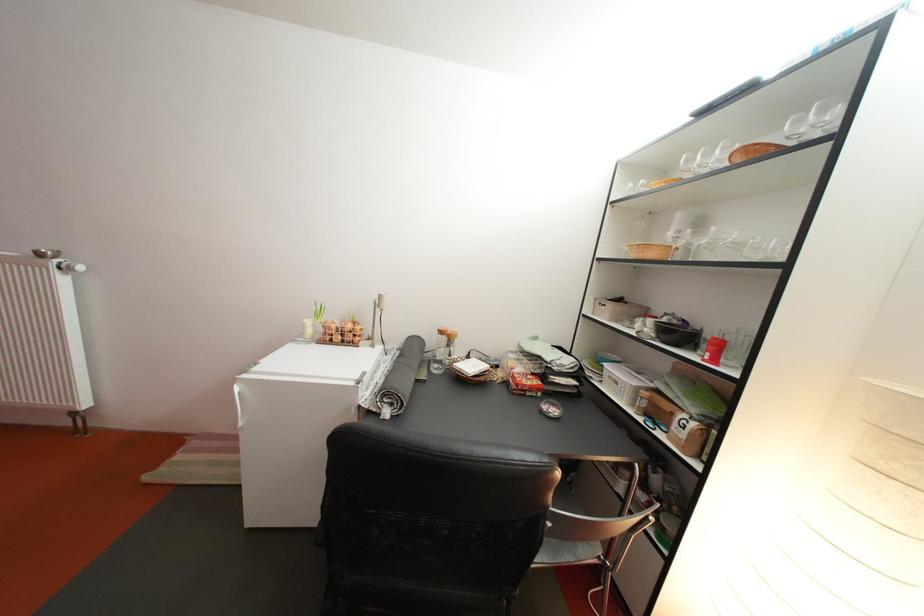
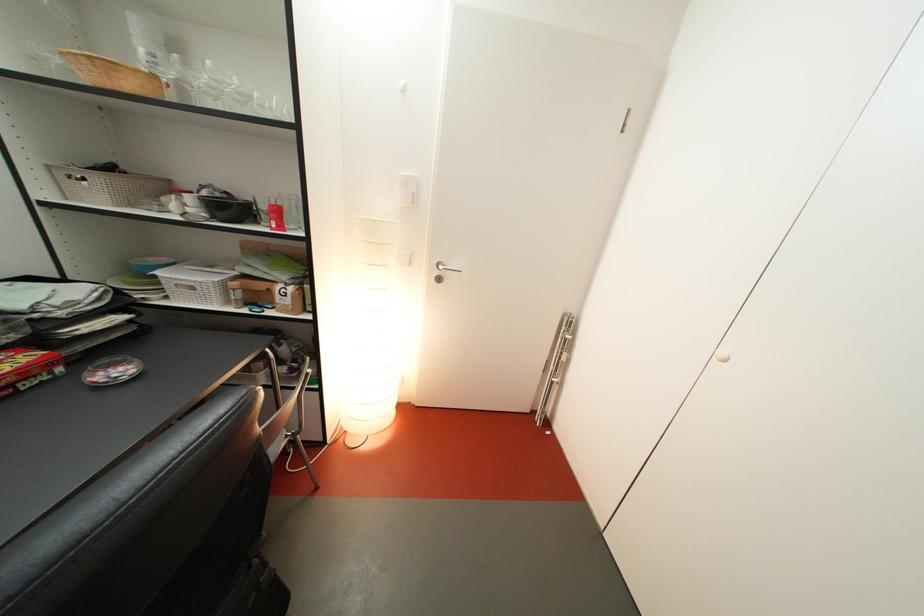
Consider the image. The first image is from the beginning of the video and the second image is from the end. How did the camera likely rotate when shooting the video?

The rotation direction of the camera is right-down.